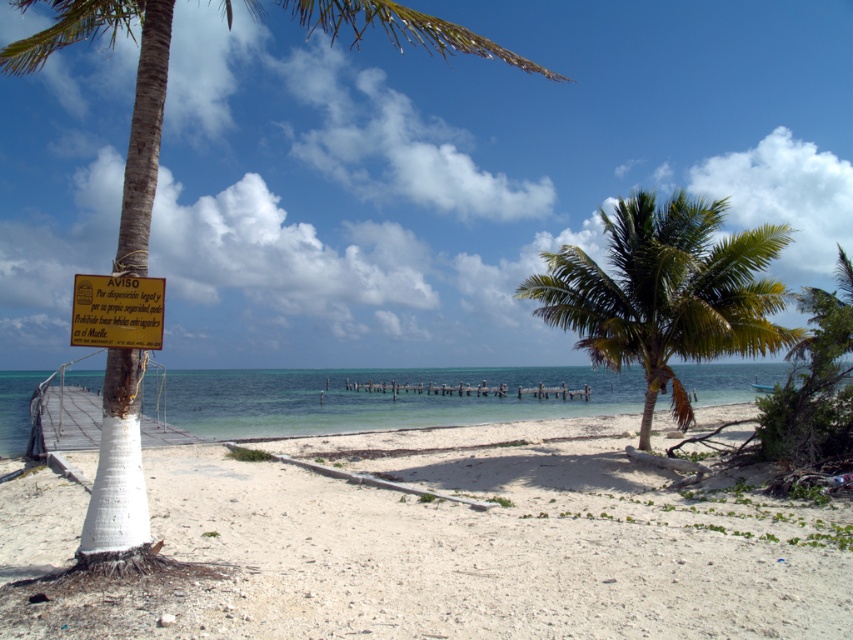
You are standing on the white sand beach at lower left and want to reach the clear blue water at center. According to the scene description, which direction should you move to get there?

You should move downward because the white sand beach at lower left is located above the clear blue water at center, so moving downward from the beach will lead you to the water.